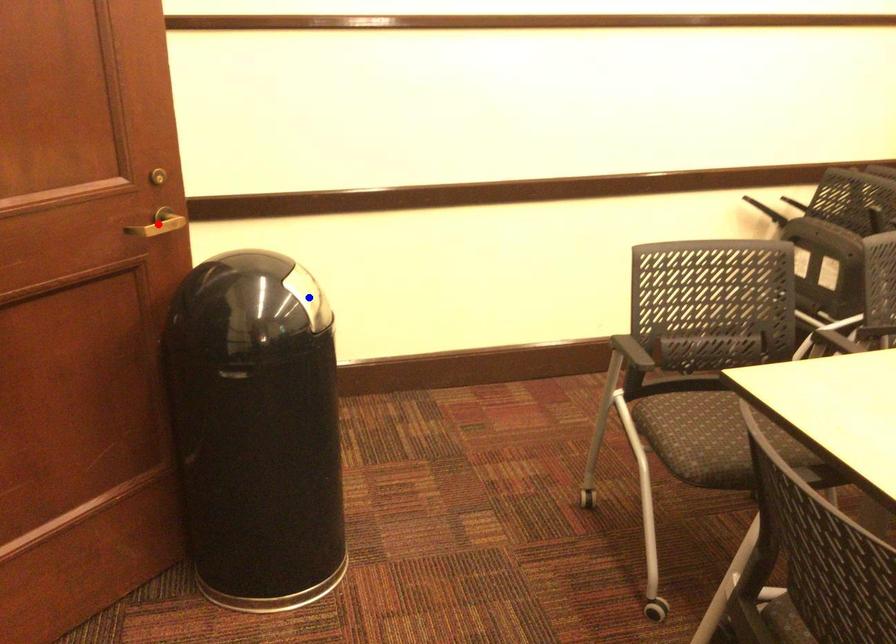
Question: Two points are marked on the image. Which point is closer to the camera?

Choices:
 (A) Blue point is closer.
 (B) Red point is closer.

Answer: (B)